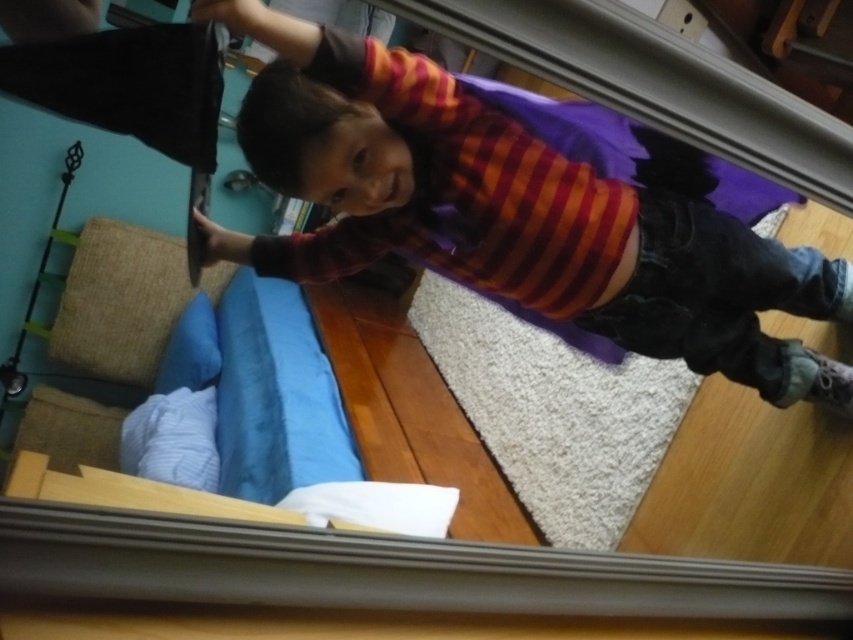
Between point (309, 262) and point (212, 422), which one is positioned in front?

Point (309, 262)

Does purple matte cape at upper center appear on the right side of white textured pillow at lower left?

Indeed, purple matte cape at upper center is positioned on the right side of white textured pillow at lower left.

Who is more forward, (845, 262) or (210, 422)?

Point (845, 262)

What are the coordinates of `purple matte cape at upper center` in the screenshot? It's located at (512, 212).

Who is more forward, [78,355] or [141,468]?

Point [141,468] is in front.

Locate an element on the screen. brown textured cushion at lower left is located at coordinates point(119,301).

Can you confirm if brown textured cushion at lower left is positioned to the right of blue soft pillow at lower left?

In fact, brown textured cushion at lower left is to the left of blue soft pillow at lower left.

Can you confirm if brown textured cushion at lower left is positioned above blue soft pillow at lower left?

Yes, brown textured cushion at lower left is above blue soft pillow at lower left.

Which is in front, point (74, 250) or point (190, 314)?

Point (190, 314)

I want to click on brown textured cushion at lower left, so click(119, 301).